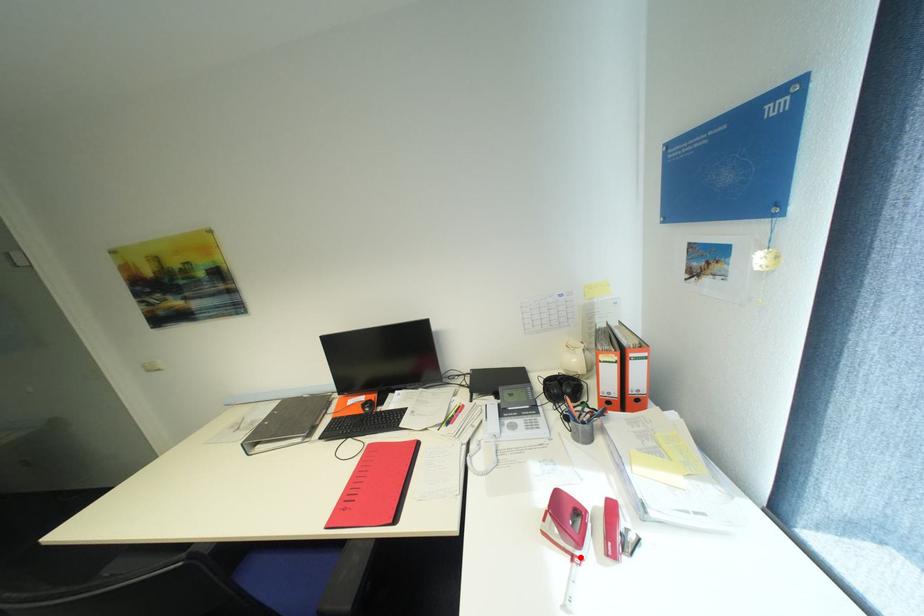
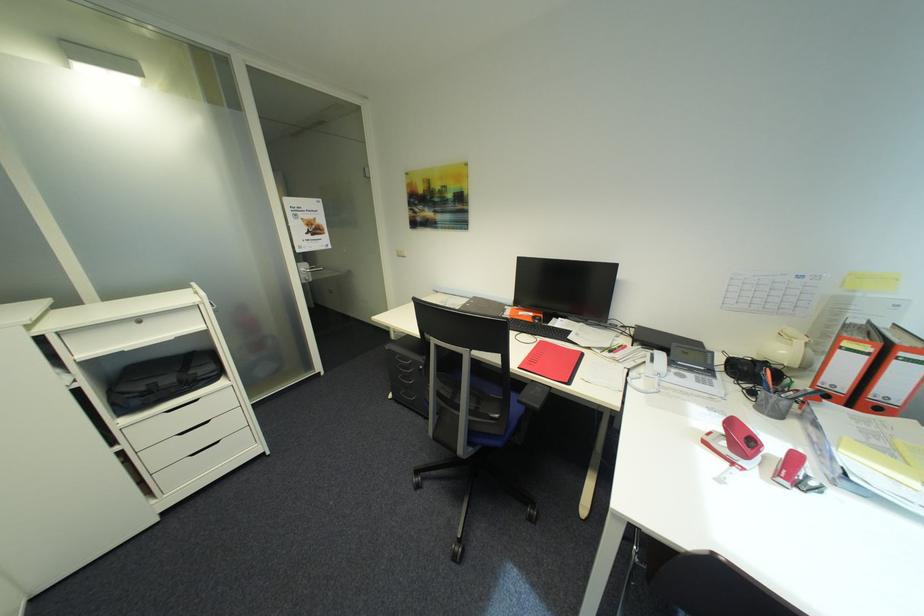
Find the pixel in the second image that matches the highlighted location in the first image.

(742, 464)